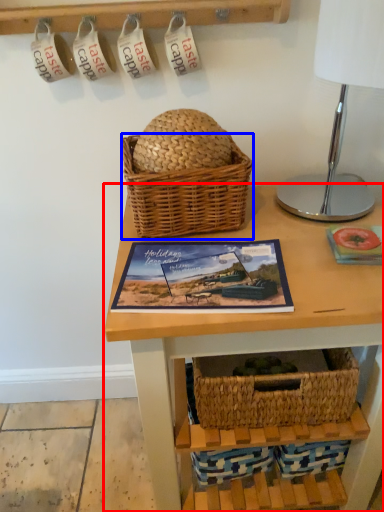
Question: Among these objects, which one is farthest to the camera, table (highlighted by a red box) or picnic basket (highlighted by a blue box)?

Choices:
 (A) table
 (B) picnic basket

Answer: (B)